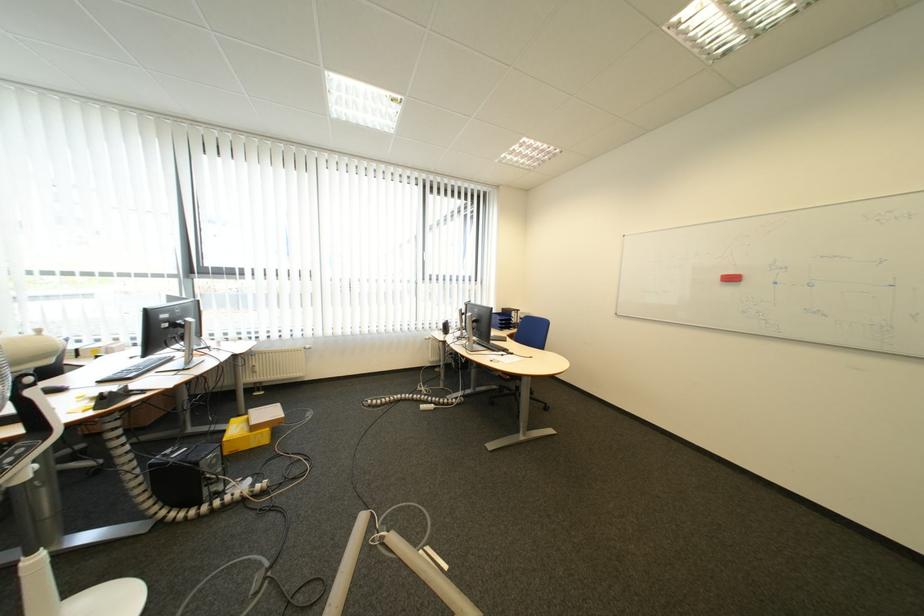
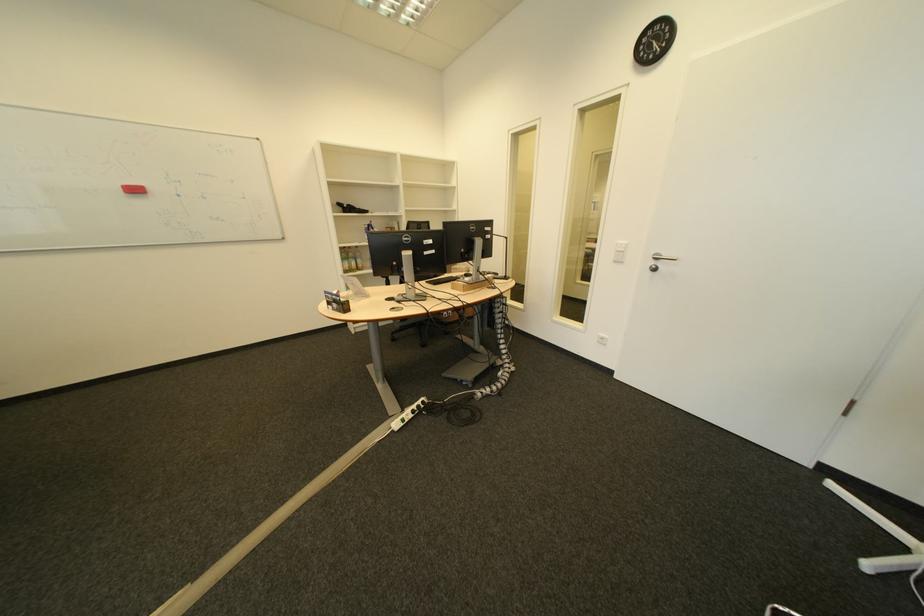
First-person continuous shooting, in which direction is the camera rotating?

The camera's rotation is toward right-down.